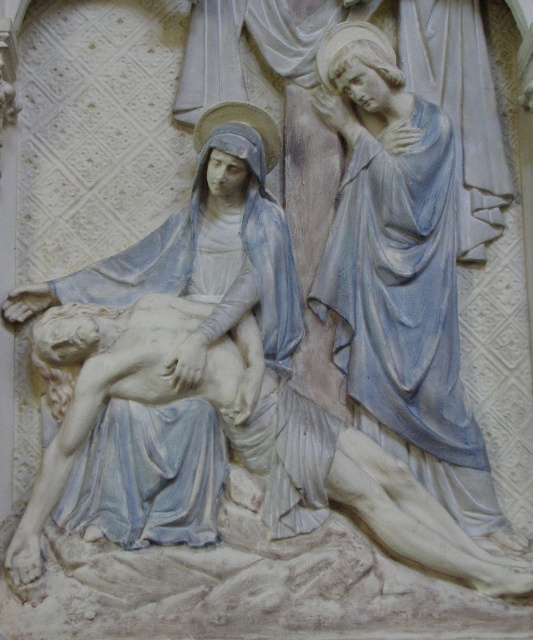
Does white marble statue at center appear on the right side of matte stone figure at upper right?

Incorrect, white marble statue at center is not on the right side of matte stone figure at upper right.

Who is lower down, white marble statue at center or matte stone figure at upper right?

white marble statue at center

Which is behind, point (133, 429) or point (421, 202)?

The point (421, 202) is behind.

Identify the location of white marble statue at center. (173, 364).